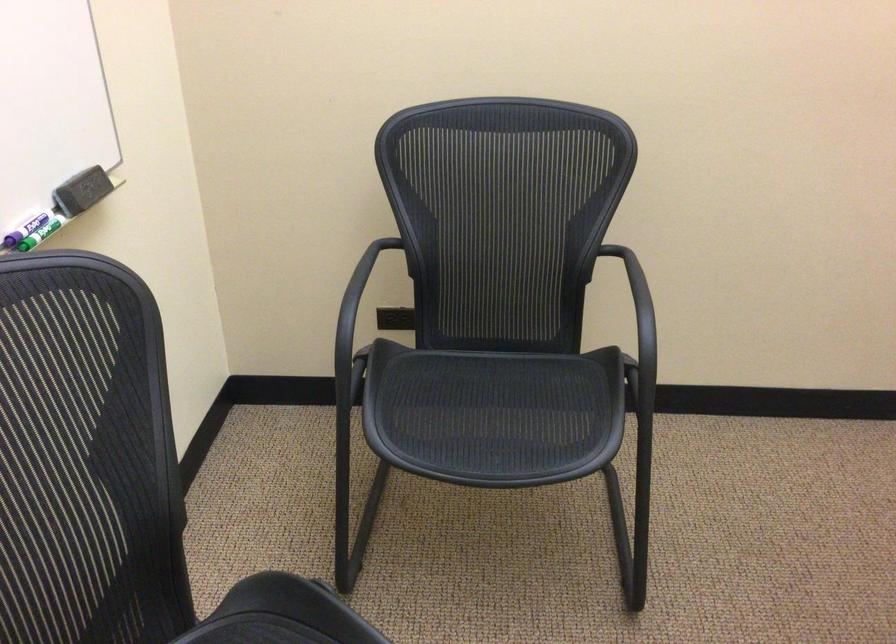
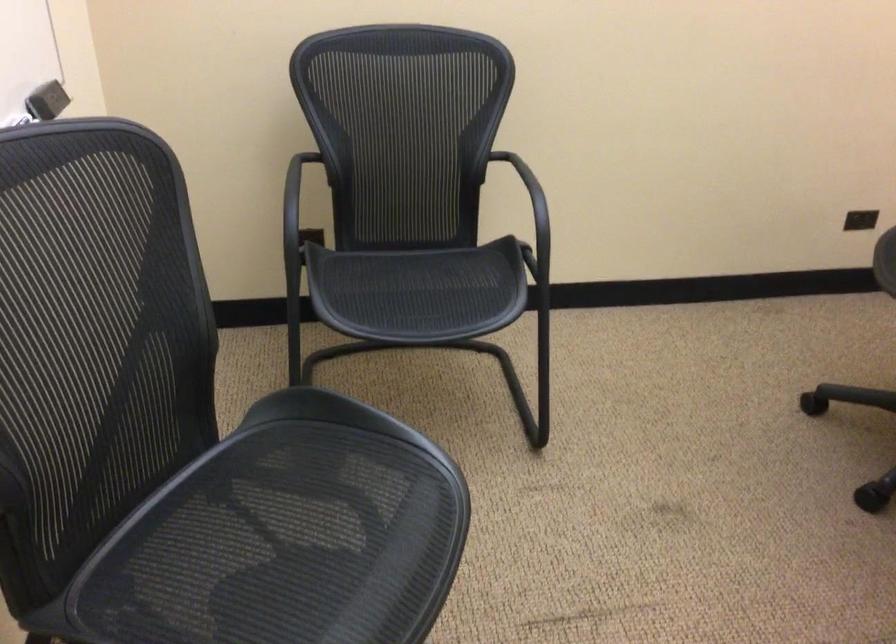
Question: The camera is either moving clockwise (left) or counter-clockwise (right) around the object. The first image is from the beginning of the video and the second image is from the end. Is the camera moving left or right when shooting the video?

Choices:
 (A) Left
 (B) Right

Answer: (A)